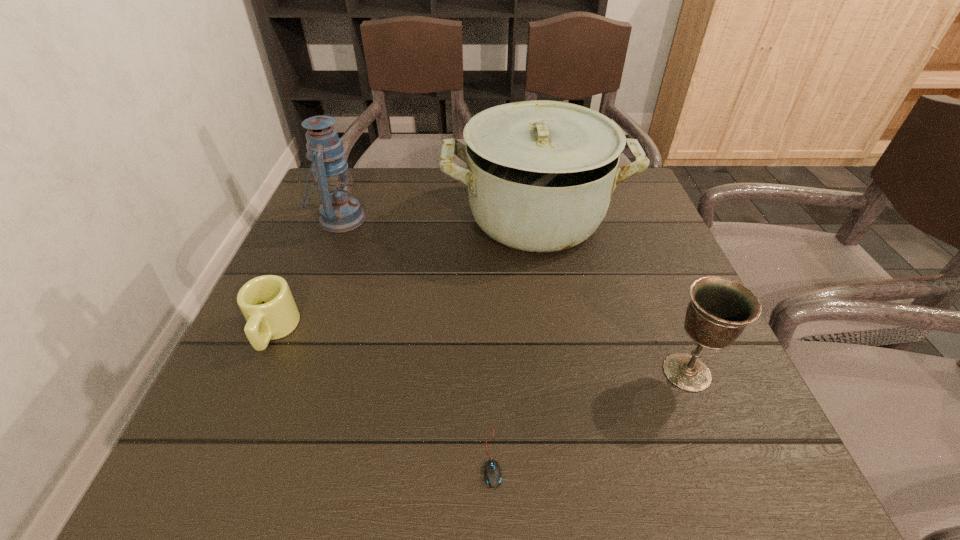
Where is `vacant space at the far edge`? Image resolution: width=960 pixels, height=540 pixels. vacant space at the far edge is located at coordinates (463, 200).

Locate an element on the screen. The image size is (960, 540). free space at the near edge of the desktop is located at coordinates coord(517,444).

This screenshot has height=540, width=960. I want to click on vacant space at the left edge, so click(334, 289).

In the image, there is a desktop. Identify the location of vacant space at the right edge. (648, 224).

Identify the location of vacant space at the far left corner of the desktop. (361, 172).

The image size is (960, 540). I want to click on vacant space at the far right corner, so click(628, 206).

In the image, there is a desktop. At what (x,y) coordinates should I click in order to perform the action: click on vacant space at the near right corner. Please return your answer as a coordinate pair (x, y). Looking at the image, I should click on (693, 469).

This screenshot has height=540, width=960. In order to click on vacant space that is in between the mug and the mouse in this screenshot , I will do `click(383, 394)`.

You are a GUI agent. You are given a task and a screenshot of the screen. Output one action in this format:
    pyautogui.click(x=<x>, y=<y>)
    Task: Click on the empty space between the shortest object and the lantern
    
    Given the screenshot: What is the action you would take?
    pyautogui.click(x=417, y=339)

You are a GUI agent. You are given a task and a screenshot of the screen. Output one action in this format:
    pyautogui.click(x=<x>, y=<y>)
    Task: Click on the unoccupied position between the chalice and the nearest object
    This screenshot has width=960, height=540.
    Given the screenshot: What is the action you would take?
    pyautogui.click(x=589, y=415)